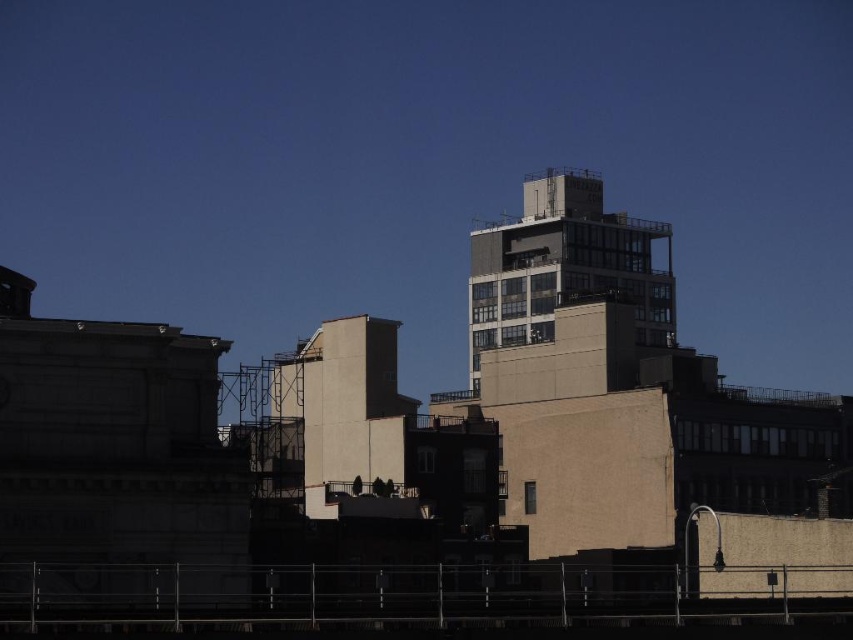
You are standing on a viewing platform and want to know how far the concrete building at center is from you. What is its distance?

The concrete building at center is 119.91 meters away from the viewer.

You are standing on a platform overlooking an urban skyline. You see a concrete building at center and a smooth beige wall at center. Which one is positioned to the right of the other?

The concrete building at center is to the right of the smooth beige wall at center.